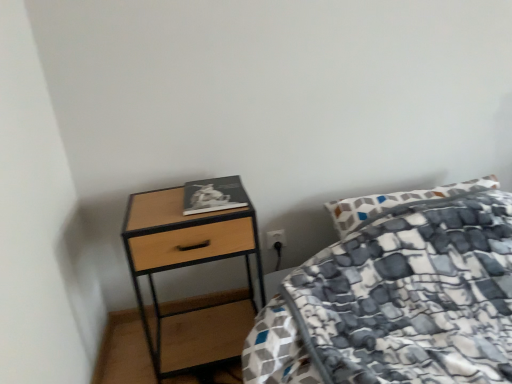
The height and width of the screenshot is (384, 512). I want to click on woodenmaterial/texturenightstand at left, so click(191, 265).

This screenshot has width=512, height=384. What do you see at coordinates (191, 265) in the screenshot? I see `woodenmaterial/texturenightstand at left` at bounding box center [191, 265].

Measure the distance between woodenmaterial/texturenightstand at left and camera.

1.50 meters.

Describe the element at coordinates (214, 195) in the screenshot. I see `matte black book at upper left` at that location.

Locate an element on the screen. Image resolution: width=512 pixels, height=384 pixels. matte black book at upper left is located at coordinates pyautogui.click(x=214, y=195).

Identify the location of woodenmaterial/texturenightstand at left. (191, 265).

Between matte black book at upper left and woodenmaterial/texturenightstand at left, which one appears on the right side from the viewer's perspective?

matte black book at upper left.

Is matte black book at upper left closer to camera compared to woodenmaterial/texturenightstand at left?

No, the depth of matte black book at upper left is greater than that of woodenmaterial/texturenightstand at left.

Is point (241, 200) farther from viewer compared to point (164, 372)?

That is False.

From the image's perspective, between matte black book at upper left and woodenmaterial/texturenightstand at left, which one is located above?

matte black book at upper left.

From a real-world perspective, between matte black book at upper left and woodenmaterial/texturenightstand at left, who is vertically higher?

matte black book at upper left is physically above.

Can you confirm if matte black book at upper left is wider than woodenmaterial/texturenightstand at left?

Incorrect, the width of matte black book at upper left does not surpass that of woodenmaterial/texturenightstand at left.

Looking at this image, considering the sizes of objects matte black book at upper left and woodenmaterial/texturenightstand at left in the image provided, who is shorter, matte black book at upper left or woodenmaterial/texturenightstand at left?

With less height is matte black book at upper left.

Is matte black book at upper left bigger than woodenmaterial/texturenightstand at left?

No, matte black book at upper left is not bigger than woodenmaterial/texturenightstand at left.

Is woodenmaterial/texturenightstand at left completely or partially inside matte black book at upper left?

Actually, woodenmaterial/texturenightstand at left is outside matte black book at upper left.

Is matte black book at upper left not close to woodenmaterial/texturenightstand at left?

No, matte black book at upper left is not far from woodenmaterial/texturenightstand at left.

Is woodenmaterial/texturenightstand at left at the back of matte black book at upper left?

No, matte black book at upper left is not facing the opposite direction of woodenmaterial/texturenightstand at left.

Measure the distance between matte black book at upper left and woodenmaterial/texturenightstand at left.

They are 20.09 inches apart.

The width and height of the screenshot is (512, 384). In order to click on table on the left of matte black book at upper left in this screenshot , I will do `click(191, 265)`.

Can you confirm if woodenmaterial/texturenightstand at left is positioned to the right of matte black book at upper left?

Incorrect, woodenmaterial/texturenightstand at left is not on the right side of matte black book at upper left.

Does woodenmaterial/texturenightstand at left come behind matte black book at upper left?

No, the depth of woodenmaterial/texturenightstand at left is less than that of matte black book at upper left.

Is point (220, 351) closer or farther from the camera than point (194, 200)?

Point (220, 351) is farther from the camera than point (194, 200).

From the image's perspective, between woodenmaterial/texturenightstand at left and matte black book at upper left, who is located below?

From the image's view, woodenmaterial/texturenightstand at left is below.

From a real-world perspective, is woodenmaterial/texturenightstand at left positioned under matte black book at upper left based on gravity?

Yes, from a real-world perspective, woodenmaterial/texturenightstand at left is under matte black book at upper left.

Does woodenmaterial/texturenightstand at left have a lesser width compared to matte black book at upper left?

No, woodenmaterial/texturenightstand at left is not thinner than matte black book at upper left.

Is woodenmaterial/texturenightstand at left taller than matte black book at upper left?

Correct, woodenmaterial/texturenightstand at left is much taller as matte black book at upper left.

Is woodenmaterial/texturenightstand at left smaller than matte black book at upper left?

Actually, woodenmaterial/texturenightstand at left might be larger than matte black book at upper left.

Is woodenmaterial/texturenightstand at left outside of matte black book at upper left?

woodenmaterial/texturenightstand at left is positioned outside matte black book at upper left.

Is woodenmaterial/texturenightstand at left placed right next to matte black book at upper left?

No, woodenmaterial/texturenightstand at left is not making contact with matte black book at upper left.

Could you tell me if woodenmaterial/texturenightstand at left is turned towards matte black book at upper left?

No.

What's the angular difference between woodenmaterial/texturenightstand at left and matte black book at upper left's facing directions?

woodenmaterial/texturenightstand at left and matte black book at upper left are facing 3.31 degrees away from each other.

Locate an element on the screen. This screenshot has width=512, height=384. table lying on the left of matte black book at upper left is located at coordinates (191, 265).

At what (x,y) coordinates should I click in order to perform the action: click on table in front of the matte black book at upper left. Please return your answer as a coordinate pair (x, y). This screenshot has width=512, height=384. Looking at the image, I should click on (191, 265).

Locate an element on the screen. table beneath the matte black book at upper left (from a real-world perspective) is located at coordinates (191, 265).